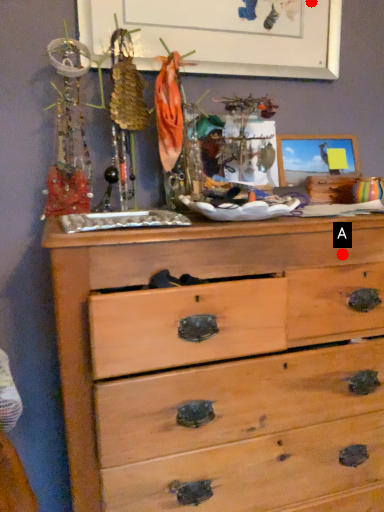
Question: Two points are circled on the image, labeled by A and B beside each circle. Among these points, which one is nearest to the camera?

Choices:
 (A) A is closer
 (B) B is closer

Answer: (A)